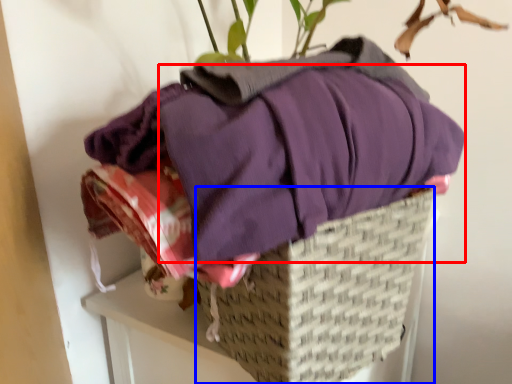
Question: Which object is closer to the camera taking this photo, clothing (highlighted by a red box) or basket (highlighted by a blue box)?

Choices:
 (A) clothing
 (B) basket

Answer: (A)